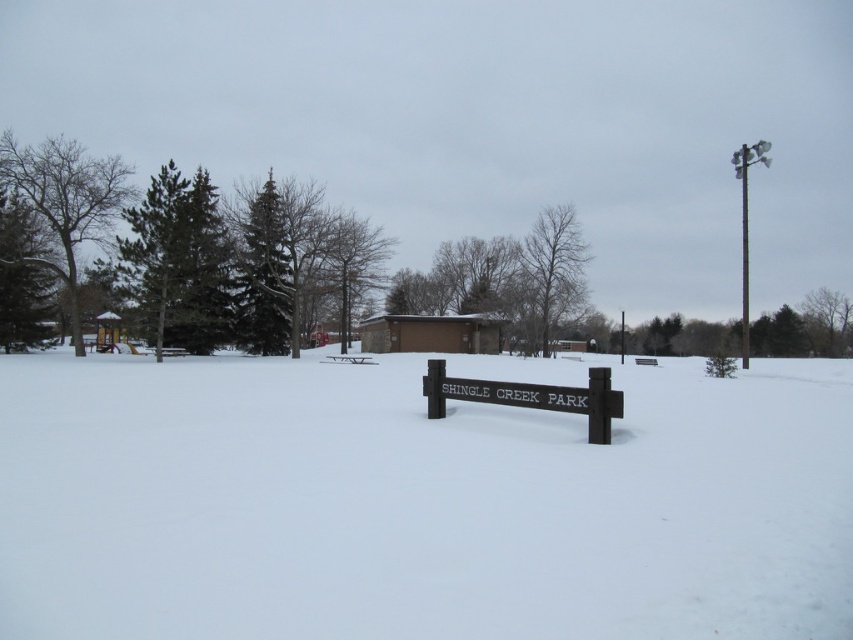
Question: Is bare wood tree at center positioned before brown wooden sign at center?

Choices:
 (A) no
 (B) yes

Answer: (A)

Question: Based on their relative distances, which object is farther from the white powdery snow at center?

Choices:
 (A) brown wooden sign at center
 (B) metallic pole at upper right
 (C) green needle-like tree at left
 (D) bare wood tree at left

Answer: (B)

Question: From the image, what is the correct spatial relationship of bare wood tree at left in relation to green leafy tree at right?

Choices:
 (A) above
 (B) below

Answer: (A)

Question: Which point is farther to the camera?

Choices:
 (A) bare wood tree at center
 (B) white powdery snow at center
 (C) brown brick hut at center

Answer: (C)

Question: Does green needle-like tree at left come behind metallic pole at upper right?

Choices:
 (A) yes
 (B) no

Answer: (A)

Question: Which point appears farthest from the camera in this image?

Choices:
 (A) (345, 301)
 (B) (744, 595)

Answer: (A)